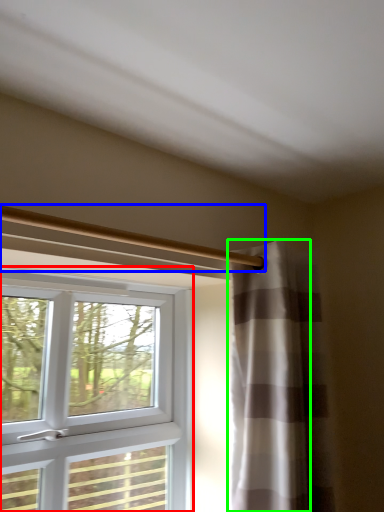
Question: Estimate the real-world distances between objects in this image. Which object is farther from window (highlighted by a red box), beam (highlighted by a blue box) or curtain (highlighted by a green box)?

Choices:
 (A) beam
 (B) curtain

Answer: (A)